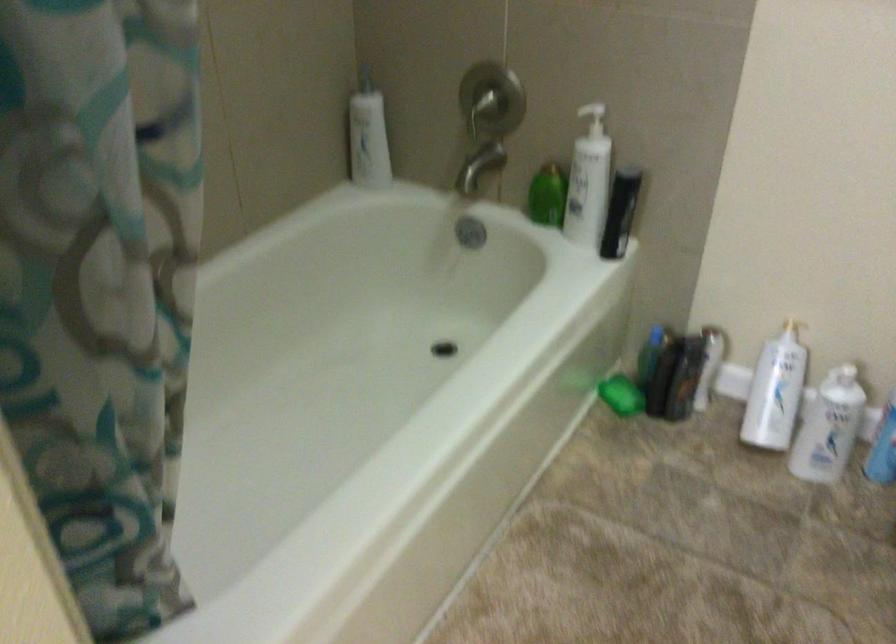
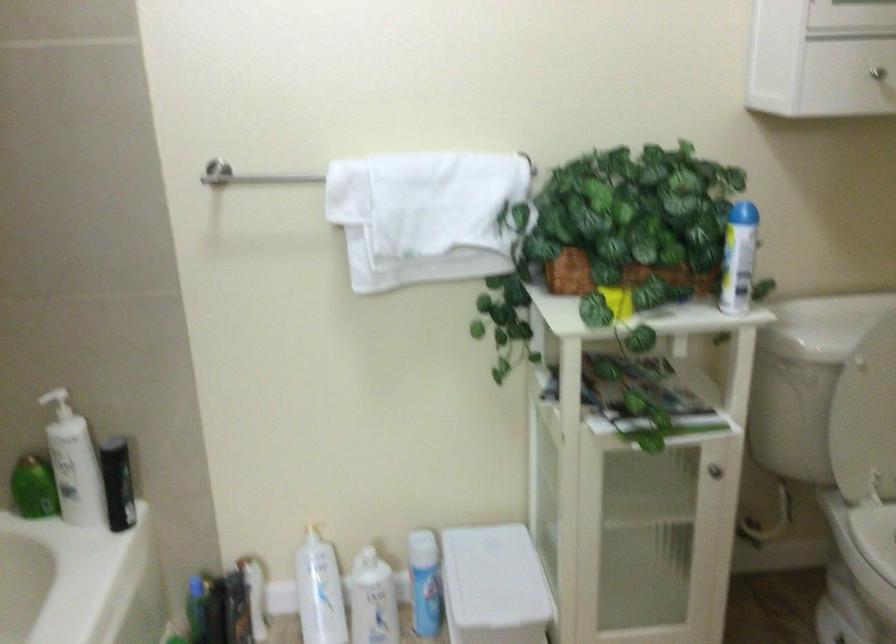
In the second image, find the point that corresponds to pixel 583 120 in the first image.

(56, 402)